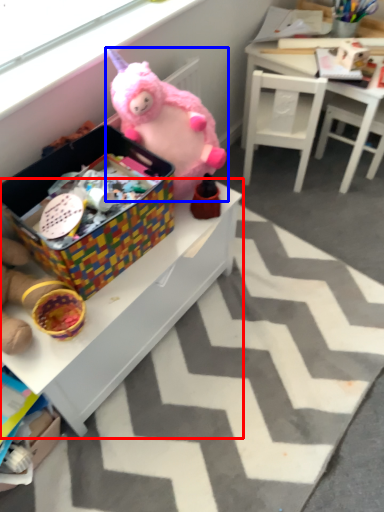
Question: Which object appears closest to the camera in this image, table (highlighted by a red box) or toy (highlighted by a blue box)?

Choices:
 (A) table
 (B) toy

Answer: (A)